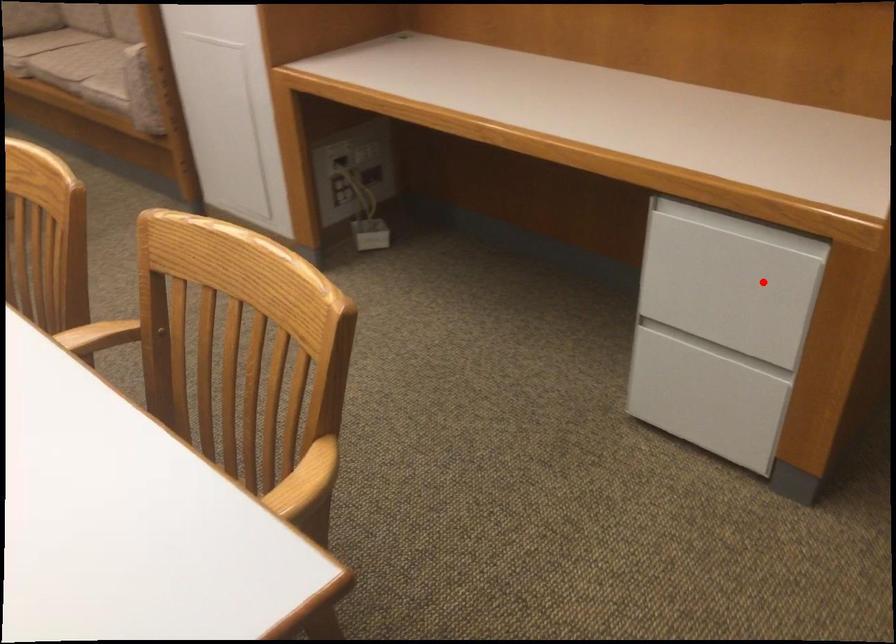
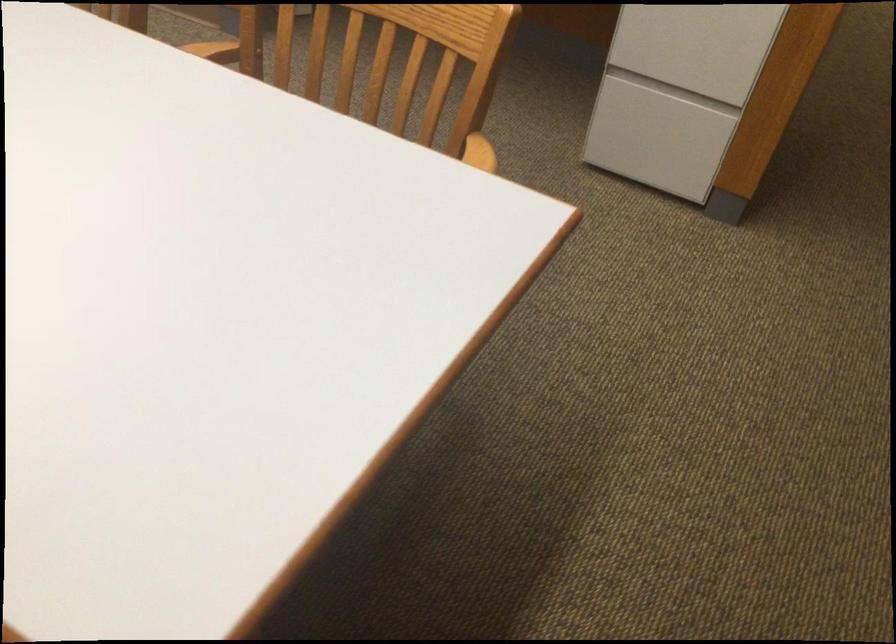
Locate, in the second image, the point that corresponds to the highlighted location in the first image.

(735, 26)